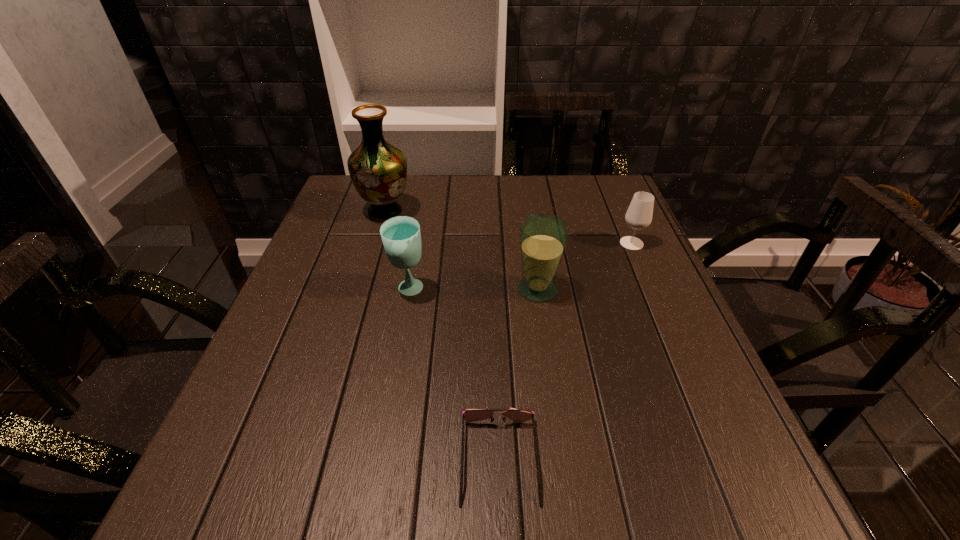
At what (x,y) coordinates should I click in order to perform the action: click on vacant region at the right edge. Please return your answer as a coordinate pair (x, y). The width and height of the screenshot is (960, 540). Looking at the image, I should click on tap(643, 259).

Image resolution: width=960 pixels, height=540 pixels. What are the coordinates of `vacant space at the far right corner` in the screenshot? It's located at (595, 179).

What are the coordinates of `vacant area at the near right corner of the desktop` in the screenshot? It's located at (722, 522).

You are a GUI agent. You are given a task and a screenshot of the screen. Output one action in this format:
    pyautogui.click(x=<x>, y=<y>)
    Task: Click on the empty space between the nearest object and the second glass from right to left
    The width and height of the screenshot is (960, 540).
    Given the screenshot: What is the action you would take?
    pyautogui.click(x=518, y=375)

Find the location of a particular element. The image size is (960, 540). free point between the second glass from left to right and the leftmost glass is located at coordinates (473, 290).

Find the location of a particular element. Image resolution: width=960 pixels, height=540 pixels. free spot between the shortest glass and the leftmost glass is located at coordinates (520, 267).

This screenshot has width=960, height=540. Find the location of `free spot between the second glass from right to left and the leftmost glass`. free spot between the second glass from right to left and the leftmost glass is located at coordinates (473, 290).

The width and height of the screenshot is (960, 540). I want to click on free spot between the leftmost glass and the rightmost glass, so tap(520, 267).

This screenshot has height=540, width=960. In order to click on vacant area between the tallest object and the nearest object in this screenshot , I will do `click(443, 336)`.

This screenshot has height=540, width=960. I want to click on free point between the rightmost glass and the second glass from left to right, so click(585, 266).